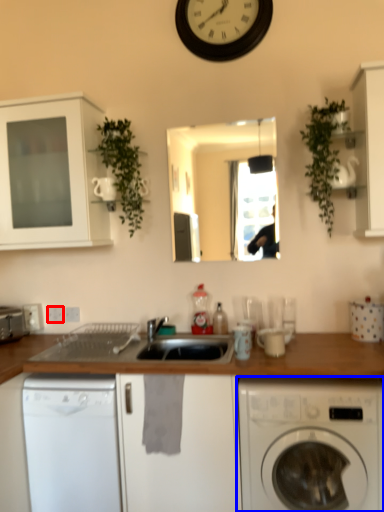
Question: Among these objects, which one is farthest to the camera, electric outlet (highlighted by a red box) or washing machine (highlighted by a blue box)?

Choices:
 (A) electric outlet
 (B) washing machine

Answer: (A)